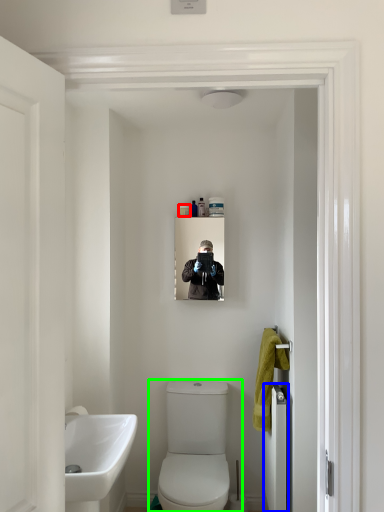
Question: Which is nearer to the toiletry (highlighted by a red box)? door (highlighted by a blue box) or toilet (highlighted by a green box).

Choices:
 (A) door
 (B) toilet

Answer: (B)